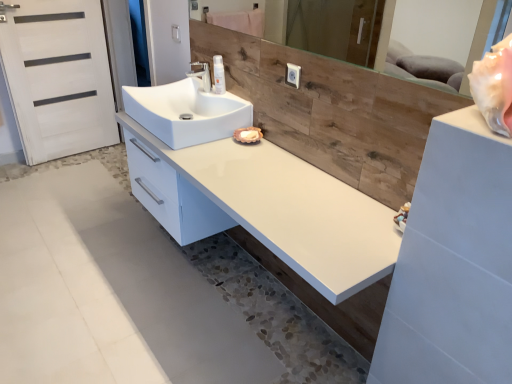
You are a GUI agent. You are given a task and a screenshot of the screen. Output one action in this format:
    pyautogui.click(x=<x>, y=<y>)
    Task: Click on the vacant area situated below white matte door at left (from a real-world perspective)
    Image resolution: width=512 pixels, height=384 pixels.
    Given the screenshot: What is the action you would take?
    pyautogui.click(x=74, y=153)